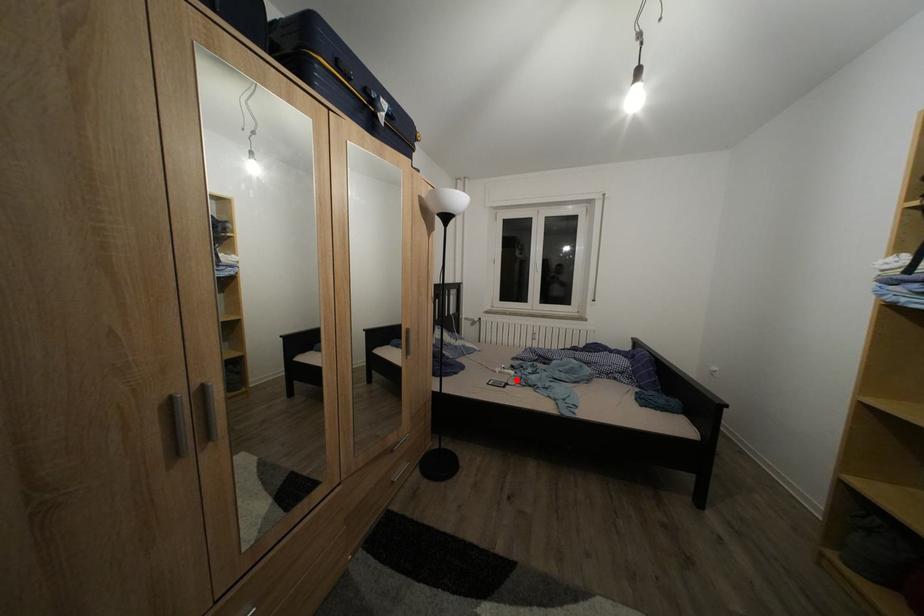
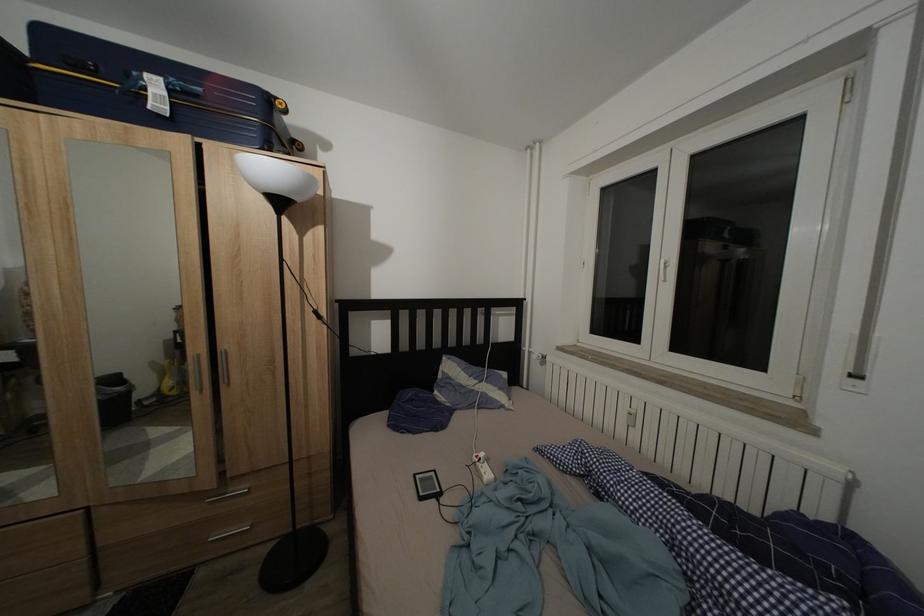
Find the pixel in the second image that matches the highlighted location in the first image.

(488, 483)